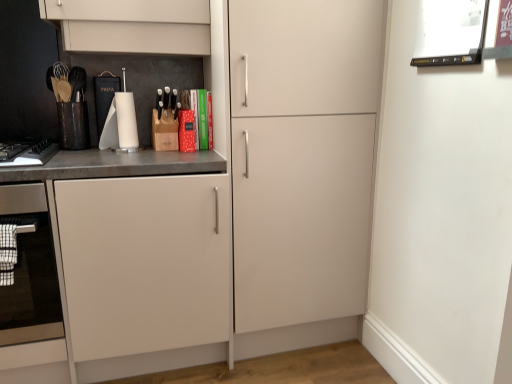
Question: Is the depth of white glossy picture frame at upper right, placed as the first appliance when sorted from right to left, greater than that of matte white cabinet at center?

Choices:
 (A) yes
 (B) no

Answer: (B)

Question: From the image's perspective, would you say white glossy picture frame at upper right, which ranks as the 1th appliance in front-to-back order, is positioned over matte white cabinet at center?

Choices:
 (A) yes
 (B) no

Answer: (A)

Question: Can you confirm if white glossy picture frame at upper right, positioned as the 2th appliance in back-to-front order, is positioned to the right of matte white cabinet at center?

Choices:
 (A) no
 (B) yes

Answer: (B)

Question: Is white glossy picture frame at upper right, positioned as the 2th appliance in back-to-front order, turned away from matte white cabinet at center?

Choices:
 (A) no
 (B) yes

Answer: (A)

Question: Is white glossy picture frame at upper right, which ranks as the 1th appliance in front-to-back order, placed right next to matte white cabinet at center?

Choices:
 (A) yes
 (B) no

Answer: (B)

Question: Is white glossy picture frame at upper right, positioned as the 2th appliance in back-to-front order, shorter than matte white cabinet at center?

Choices:
 (A) yes
 (B) no

Answer: (A)

Question: Is matte white cabinet at center not near black matte keyboard at left?

Choices:
 (A) no
 (B) yes

Answer: (A)

Question: Is matte white cabinet at center at the left side of black matte keyboard at left?

Choices:
 (A) yes
 (B) no

Answer: (B)

Question: Can you confirm if matte white cabinet at center is taller than black matte keyboard at left?

Choices:
 (A) yes
 (B) no

Answer: (A)

Question: Considering the relative sizes of matte white cabinet at center and black matte keyboard at left in the image provided, is matte white cabinet at center wider than black matte keyboard at left?

Choices:
 (A) yes
 (B) no

Answer: (A)

Question: Is black matte keyboard at left inside matte white cabinet at center?

Choices:
 (A) yes
 (B) no

Answer: (A)

Question: Considering the relative sizes of matte white cabinet at center and black matte keyboard at left in the image provided, is matte white cabinet at center shorter than black matte keyboard at left?

Choices:
 (A) no
 (B) yes

Answer: (A)

Question: Considering the relative sizes of black matte keyboard at left and white glossy paper towel holder at center, the second appliance in the right-to-left sequence, in the image provided, is black matte keyboard at left taller than white glossy paper towel holder at center, the second appliance in the right-to-left sequence,?

Choices:
 (A) no
 (B) yes

Answer: (A)